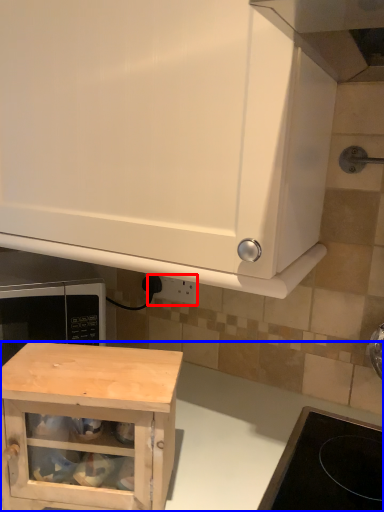
Question: Which object is closer to the camera taking this photo, electric outlet (highlighted by a red box) or counter (highlighted by a blue box)?

Choices:
 (A) electric outlet
 (B) counter

Answer: (B)